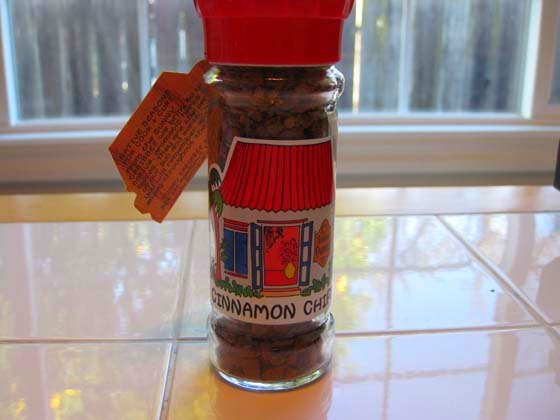
I want to click on window frame, so click(364, 145).